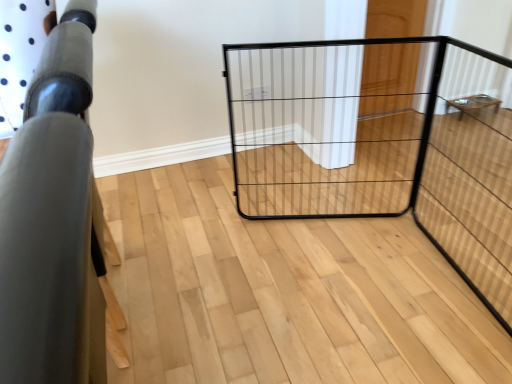
Question: In terms of width, does wooden door at upper right look wider or thinner when compared to black wire cage at center?

Choices:
 (A) wide
 (B) thin

Answer: (B)

Question: Is wooden door at upper right bigger or smaller than black wire cage at center?

Choices:
 (A) small
 (B) big

Answer: (A)

Question: Which object is the farthest from the black wire cage at center?

Choices:
 (A) wooden table at right, marked as the second furniture in a left-to-right arrangement
 (B) matte black railing at left, which ranks as the 1th furniture in front-to-back order
 (C) wooden door at upper right

Answer: (B)

Question: Considering the real-world distances, which object is closest to the black wire cage at center?

Choices:
 (A) matte black railing at left, positioned as the 2th furniture in back-to-front order
 (B) wooden door at upper right
 (C) wooden table at right, the first furniture in the top-to-bottom sequence

Answer: (B)